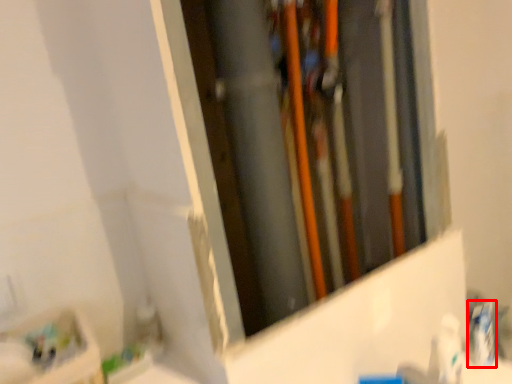
Question: From the image's perspective, considering the relative positions of toothpaste (annotated by the red box) and toiletry in the image provided, where is toothpaste (annotated by the red box) located with respect to the staircase?

Choices:
 (A) below
 (B) above

Answer: (B)